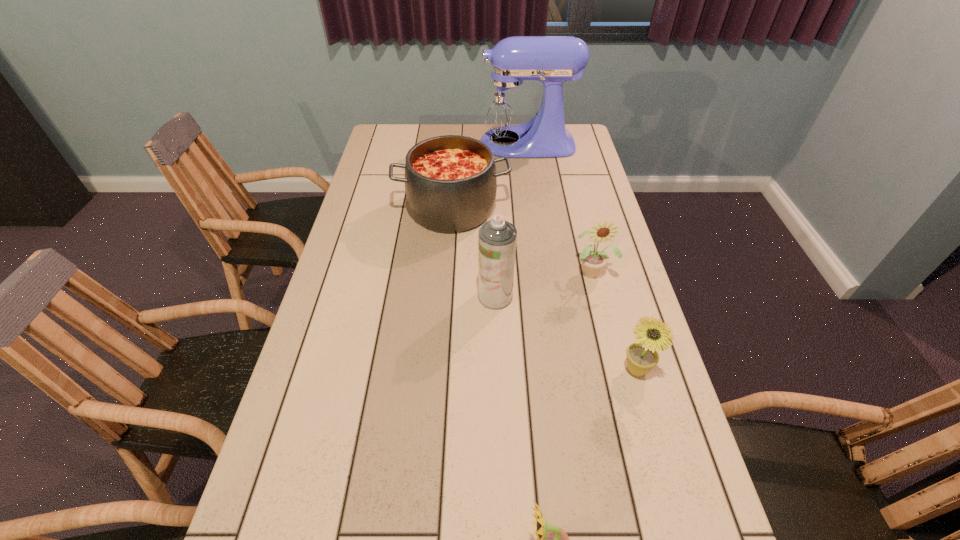
Choose which sunflower is the nearest neighbor to the second farthest object. Please provide its 2D coordinates. Your answer should be formatted as a tuple, i.e. [(x, y)], where the tuple contains the x and y coordinates of a point satisfying the conditions above.

[(592, 260)]